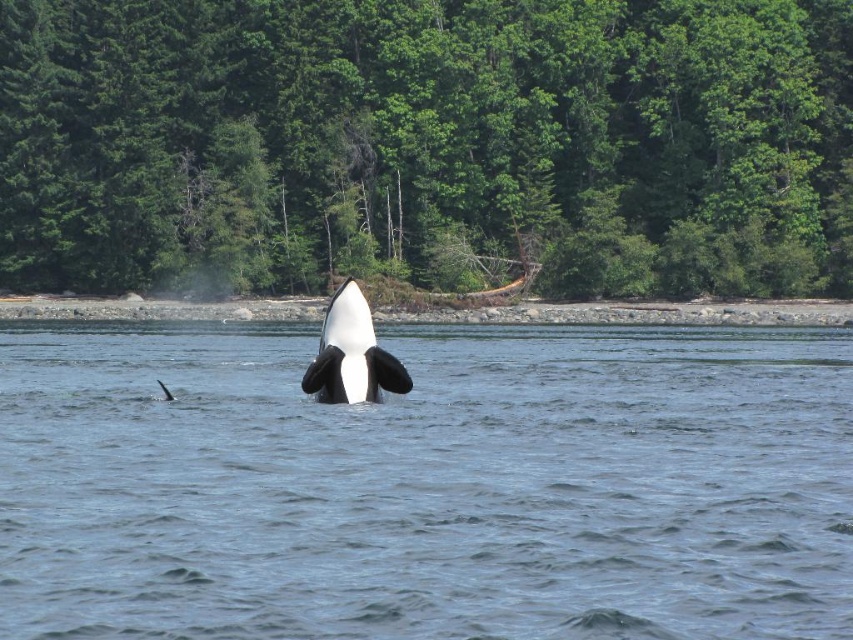
Question: Among these objects, which one is farthest from the camera?

Choices:
 (A) black/white skin whale at center
 (B) clear blue water at center

Answer: (A)

Question: Does clear blue water at center appear on the left side of black/white skin whale at center?

Choices:
 (A) yes
 (B) no

Answer: (B)

Question: Is clear blue water at center behind black/white skin whale at center?

Choices:
 (A) yes
 (B) no

Answer: (B)

Question: Is clear blue water at center thinner than black/white skin whale at center?

Choices:
 (A) yes
 (B) no

Answer: (B)

Question: Among these points, which one is farthest from the camera?

Choices:
 (A) (500, 547)
 (B) (309, 381)

Answer: (B)

Question: Which object is farther from the camera taking this photo?

Choices:
 (A) clear blue water at center
 (B) black/white skin whale at center

Answer: (B)